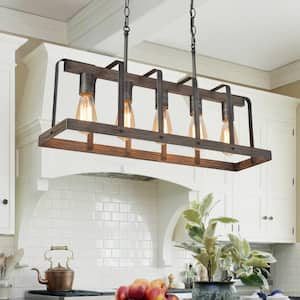
Identify the location of wall. The width and height of the screenshot is (300, 300). (127, 224).